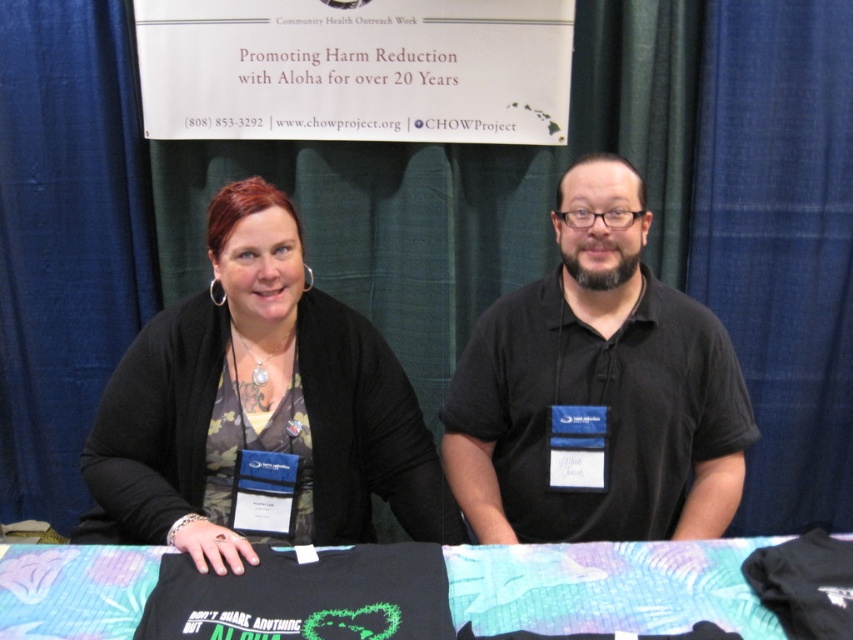
You are organizing a photo shoot for the CHOW Project and need to ensure that the two shirts displayed at the center of the image are visible in the frame. Given that the camouflage fabric shirt at center is wider than the black matte shirt at center, which shirt should you position closer to the camera to avoid overlapping with other elements?

The camouflage fabric shirt at center is wider than the black matte shirt at center, so positioning the camouflage fabric shirt at center closer to the camera will help prevent overlapping with other elements due to its larger width.

What is the color of the shirt worn by the person at the coordinates point (598, 387)?

The point (598, 387) corresponds to the black matte shirt at center.

You are a photographer at the event and need to capture a photo of both the black matte shirt at center and the black fabric at center in the same frame. The camera you are using has a minimum focus distance of 14 inches. Can you take the photo without moving either object?

The distance between the black matte shirt at center and the black fabric at center is 13.94 inches, which is slightly less than the camera minimum focus distance of 14 inches. Therefore, you cannot take the photo without moving either object to increase the distance between them.